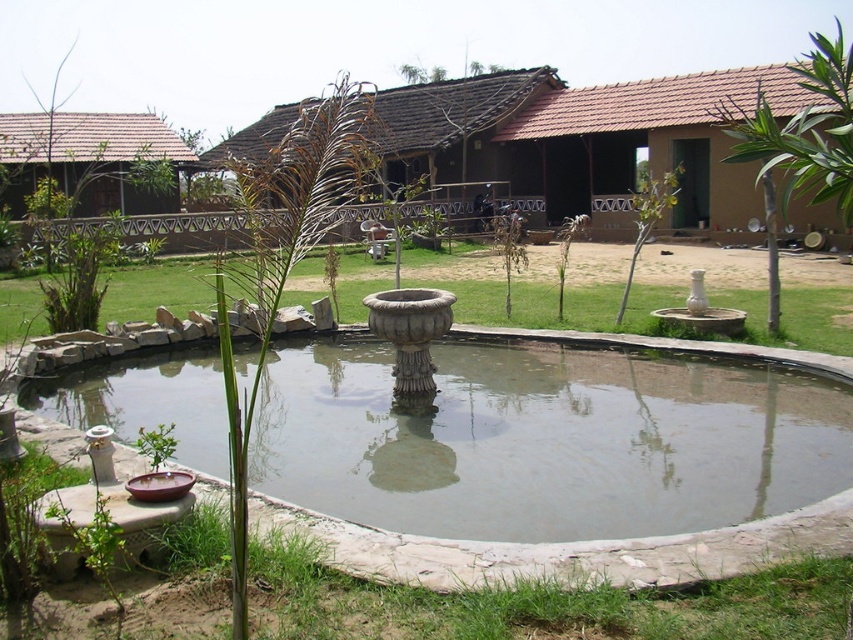
Can you confirm if clear water at pond center is taller than brown thatched hut at left?

No.

Between clear water at pond center and brown thatched hut at left, which one appears on the left side from the viewer's perspective?

From the viewer's perspective, brown thatched hut at left appears more on the left side.

Who is more forward, (254,460) or (7,157)?

Point (254,460) is more forward.

At what (x,y) coordinates should I click in order to perform the action: click on clear water at pond center. Please return your answer as a coordinate pair (x, y). Looking at the image, I should click on (548, 440).

Is the position of brown stone fountain at center more distant than that of brown thatched hut at left?

No.

Does brown stone fountain at center appear over brown thatched hut at left?

Incorrect, brown stone fountain at center is not positioned above brown thatched hut at left.

Is point (834, 280) positioned behind point (76, 173)?

No, it is not.

This screenshot has width=853, height=640. I want to click on brown stone fountain at center, so click(x=526, y=285).

Looking at this image, is clear water at pond center in front of brown clay hut at center?

Yes, clear water at pond center is in front of brown clay hut at center.

Who is positioned more to the left, clear water at pond center or brown clay hut at center?

Positioned to the left is brown clay hut at center.

Measure the distance between point (80, 376) and camera.

A distance of 8.67 meters exists between point (80, 376) and camera.

Locate an element on the screen. The image size is (853, 640). clear water at pond center is located at coordinates (548, 440).